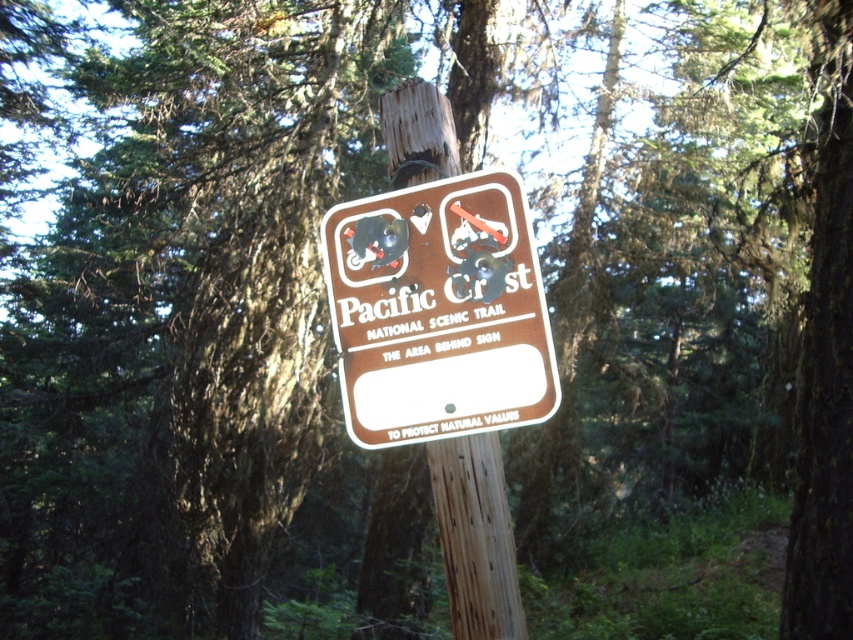
How distant is brown matte sign at center from brown wood pole at center?

The distance of brown matte sign at center from brown wood pole at center is 13.60 feet.

Does brown matte sign at center come in front of brown wood pole at center?

Yes, brown matte sign at center is closer to the viewer.

What do you see at coordinates (438, 310) in the screenshot? I see `brown matte sign at center` at bounding box center [438, 310].

The height and width of the screenshot is (640, 853). I want to click on brown matte sign at center, so click(x=438, y=310).